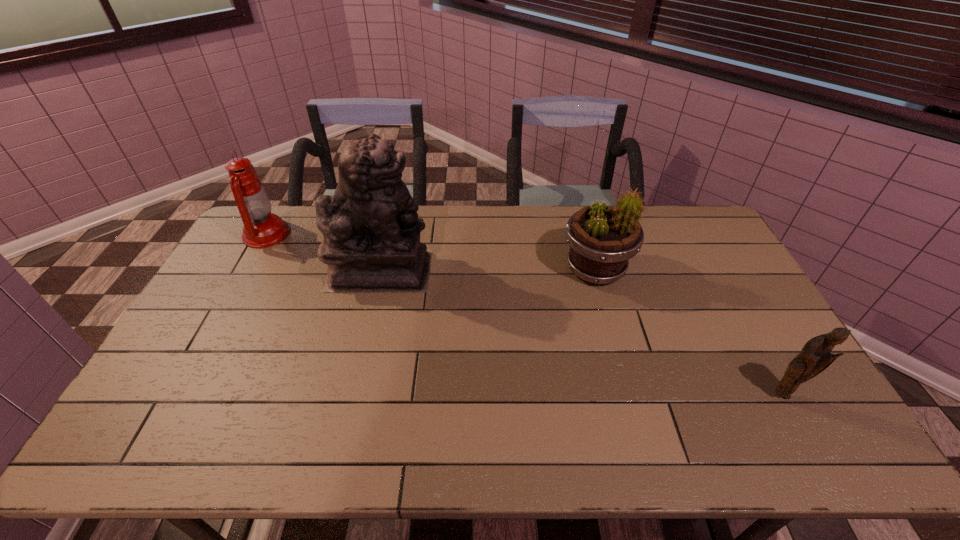
This screenshot has height=540, width=960. I want to click on oil lamp that is positioned at the far edge, so click(x=262, y=229).

Where is `flowerpot at the far edge`? This screenshot has height=540, width=960. flowerpot at the far edge is located at coordinates (602, 239).

Image resolution: width=960 pixels, height=540 pixels. Find the location of `object present at the left edge`. object present at the left edge is located at coordinates (262, 229).

Where is `object that is at the right edge`? The height and width of the screenshot is (540, 960). object that is at the right edge is located at coordinates (815, 357).

The image size is (960, 540). What are the coordinates of `object that is at the far left corner` in the screenshot? It's located at (262, 229).

In the image, there is a desktop. What are the coordinates of `vacant space at the far edge` in the screenshot? It's located at (476, 233).

In the image, there is a desktop. Where is `vacant area at the near edge`? The width and height of the screenshot is (960, 540). vacant area at the near edge is located at coordinates (754, 450).

This screenshot has height=540, width=960. In the image, there is a desktop. What are the coordinates of `vacant space at the left edge` in the screenshot? It's located at (225, 303).

Find the location of a particular element. free region at the right edge of the desktop is located at coordinates (705, 259).

You are a GUI agent. You are given a task and a screenshot of the screen. Output one action in this format:
    pyautogui.click(x=<x>, y=<y>)
    Task: Click on the vacant space at the near right corner of the desktop
    This screenshot has width=960, height=540.
    Given the screenshot: What is the action you would take?
    pyautogui.click(x=840, y=457)